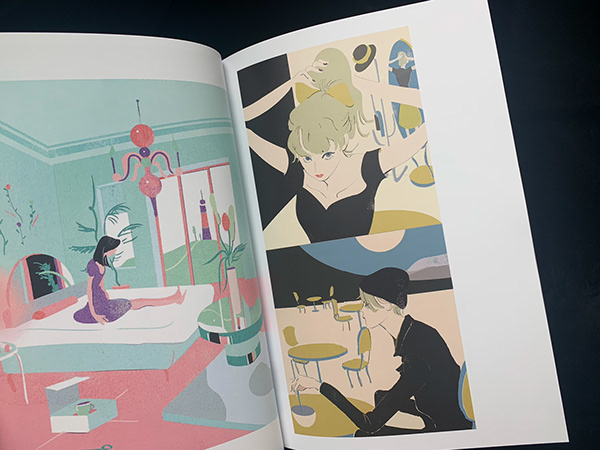
Locate an element on the screen. This screenshot has height=450, width=600. bed is located at coordinates (149, 322).